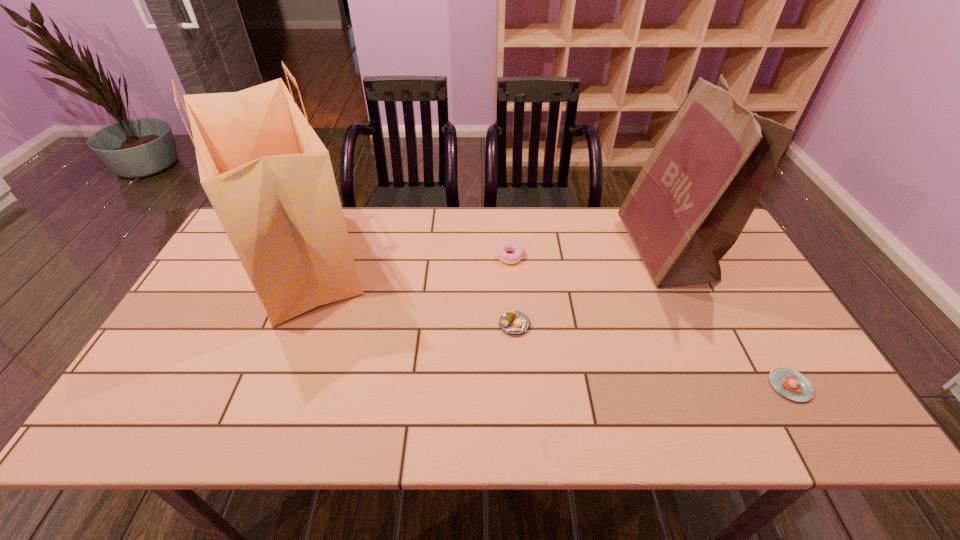
Locate an element on the screen. The image size is (960, 540). the left grocery bag is located at coordinates (268, 176).

What are the coordinates of `the right grocery bag` in the screenshot? It's located at (690, 202).

Image resolution: width=960 pixels, height=540 pixels. Identify the location of the farthest pastry. (518, 249).

Where is `the second farthest pastry`? the second farthest pastry is located at coordinates pyautogui.click(x=513, y=322).

Image resolution: width=960 pixels, height=540 pixels. Find the location of `the nearest object`. the nearest object is located at coordinates (790, 383).

You are a GUI agent. You are given a task and a screenshot of the screen. Output one action in this format:
    pyautogui.click(x=<x>, y=<y>)
    Task: Click on the nearest pastry
    
    Given the screenshot: What is the action you would take?
    pyautogui.click(x=790, y=383)

The image size is (960, 540). Identify the location of free space located 0.190m on the side of the leftmost object with the superhero design. (436, 259).

Image resolution: width=960 pixels, height=540 pixels. I want to click on free region located 0.050m on the front-facing side of the right grocery bag, so click(x=612, y=251).

Where is `vacant space located 0.230m on the front-facing side of the right grocery bag`? The width and height of the screenshot is (960, 540). vacant space located 0.230m on the front-facing side of the right grocery bag is located at coordinates (554, 251).

Where is `free space located 0.100m on the front-facing side of the right grocery bag`? The image size is (960, 540). free space located 0.100m on the front-facing side of the right grocery bag is located at coordinates (595, 251).